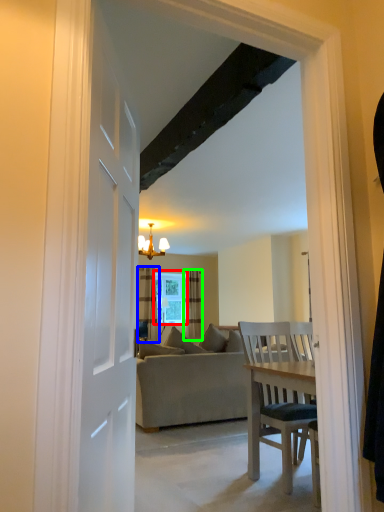
Question: Estimate the real-world distances between objects in this image. Which object is farther from window (highlighted by a red box), curtain (highlighted by a blue box) or curtain (highlighted by a green box)?

Choices:
 (A) curtain
 (B) curtain

Answer: (A)